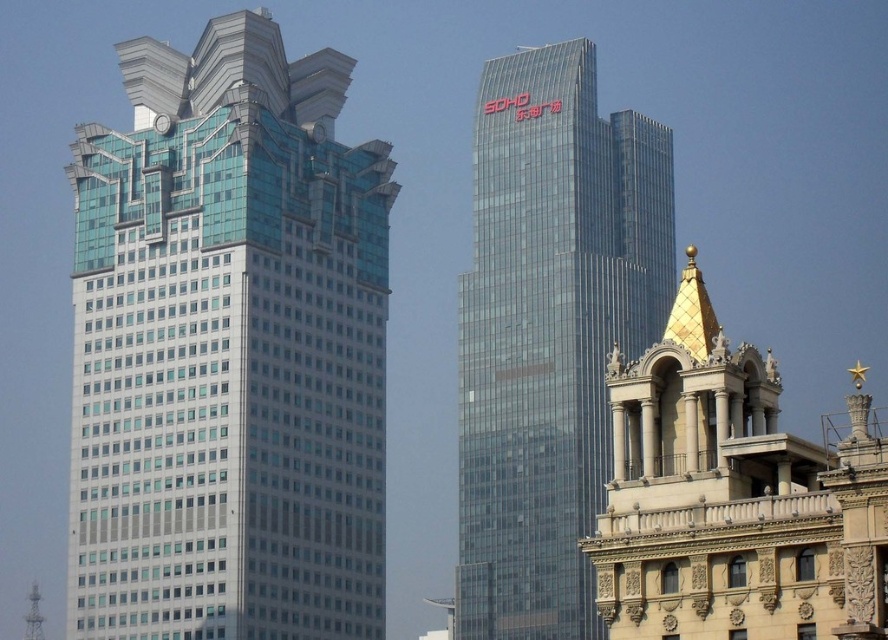
Question: Can you confirm if glassy steel skyscraper at left is thinner than transparent glass tower at center?

Choices:
 (A) yes
 (B) no

Answer: (B)

Question: Which point is closer to the camera taking this photo?

Choices:
 (A) (496, 285)
 (B) (254, 532)

Answer: (B)

Question: Does glassy steel skyscraper at left have a smaller size compared to transparent glass tower at center?

Choices:
 (A) no
 (B) yes

Answer: (A)

Question: Which point appears farthest from the camera in this image?

Choices:
 (A) pyautogui.click(x=230, y=512)
 (B) pyautogui.click(x=465, y=376)

Answer: (B)

Question: Is glassy steel skyscraper at left above transparent glass tower at center?

Choices:
 (A) no
 (B) yes

Answer: (A)

Question: Which of the following is the farthest from the observer?

Choices:
 (A) glassy steel skyscraper at left
 (B) transparent glass tower at center

Answer: (B)